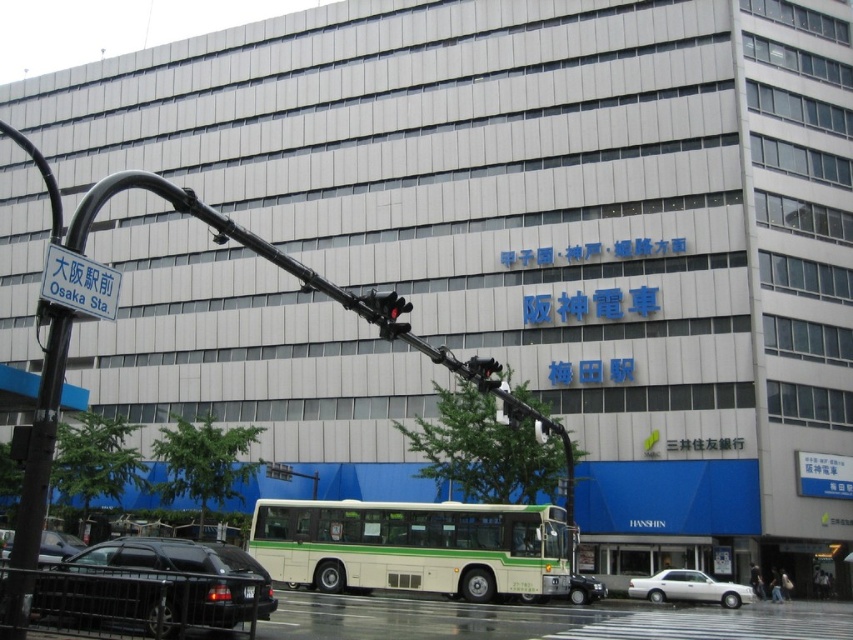
You are a GUI agent. You are given a task and a screenshot of the screen. Output one action in this format:
    pyautogui.click(x=<x>, y=<y>)
    Task: Click on the white matte sedan at center
    The height and width of the screenshot is (640, 853).
    Given the screenshot: What is the action you would take?
    pyautogui.click(x=688, y=588)

Which is behind, point (700, 600) or point (569, 589)?

The point (700, 600) is behind.

The height and width of the screenshot is (640, 853). Identify the location of white matte sedan at center. (688, 588).

Looking at this image, which is below, white matte sedan at center or matte black car at lower left?

white matte sedan at center

Is white matte sedan at center taller than matte black car at lower left?

Incorrect, white matte sedan at center's height is not larger of matte black car at lower left's.

Between point (671, 596) and point (61, 548), which one is positioned behind?

Positioned behind is point (671, 596).

Where is `white matte sedan at center`? The image size is (853, 640). white matte sedan at center is located at coordinates (688, 588).

Can you confirm if white plastic street sign at upper left is thinner than red glass traffic light at center?

Correct, white plastic street sign at upper left's width is less than red glass traffic light at center's.

Between white plastic street sign at upper left and red glass traffic light at center, which one has more height?

Standing taller between the two is red glass traffic light at center.

Which is behind, point (74, 269) or point (370, 291)?

Positioned behind is point (370, 291).

Where is `white plastic street sign at upper left`? This screenshot has height=640, width=853. white plastic street sign at upper left is located at coordinates (79, 284).